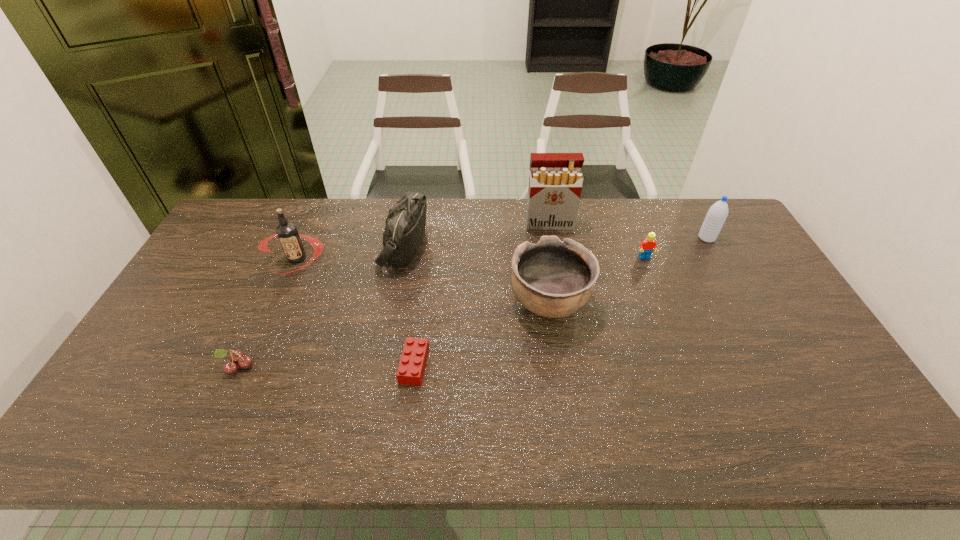
Locate an element on the screen. The width and height of the screenshot is (960, 540). free point located with the lid open on the tallest object is located at coordinates (560, 288).

Locate an element on the screen. The height and width of the screenshot is (540, 960). vacant space located 0.360m at the front padded panel of the shoulder bag is located at coordinates (535, 246).

You are a GUI agent. You are given a task and a screenshot of the screen. Output one action in this format:
    pyautogui.click(x=<x>, y=<y>)
    Task: Click on the free spot located on the label of the root beer
    Image resolution: width=960 pixels, height=540 pixels.
    Given the screenshot: What is the action you would take?
    pyautogui.click(x=253, y=360)

Where is `free space located 0.140m on the back of the rightmost object`? free space located 0.140m on the back of the rightmost object is located at coordinates (690, 208).

Identify the location of blank space located on the front of the pottery. This screenshot has height=540, width=960. (560, 374).

Identify the location of free region located 0.140m on the face of the third shortest object. The image size is (960, 540). (659, 293).

Locate an element on the screen. The width and height of the screenshot is (960, 540). blank space located on the leaves of the cherry is located at coordinates (208, 430).

Locate an element on the screen. The width and height of the screenshot is (960, 540). vacant position located on the right of the shorter Lego is located at coordinates (546, 365).

Locate an element on the screen. The width and height of the screenshot is (960, 540). cigarette case that is at the far edge is located at coordinates (555, 182).

Locate an element on the screen. The image size is (960, 540). shoulder bag located in the far edge section of the desktop is located at coordinates (405, 224).